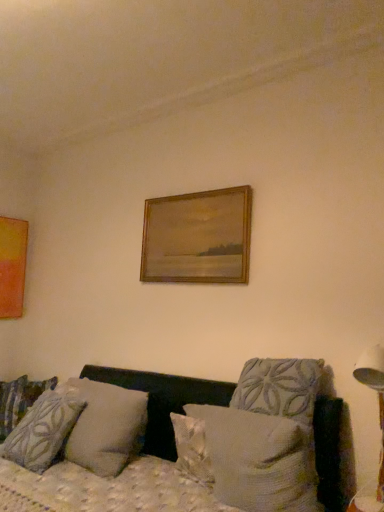
Question: Is matte orange picture frame at left, acting as the 2th picture frame starting from the front, positioned before textured fabric couch at lower center?

Choices:
 (A) yes
 (B) no

Answer: (B)

Question: Does matte orange picture frame at left, which appears as the 1th picture frame when viewed from the left, have a greater height compared to textured fabric couch at lower center?

Choices:
 (A) yes
 (B) no

Answer: (B)

Question: Is matte orange picture frame at left, positioned as the 1th picture frame in back-to-front order, positioned with its back to textured fabric couch at lower center?

Choices:
 (A) no
 (B) yes

Answer: (A)

Question: Can you confirm if matte orange picture frame at left, which appears as the 1th picture frame when viewed from the left, is thinner than textured fabric couch at lower center?

Choices:
 (A) no
 (B) yes

Answer: (B)

Question: From the image's perspective, is matte orange picture frame at left, acting as the 2th picture frame starting from the front, on textured fabric couch at lower center?

Choices:
 (A) no
 (B) yes

Answer: (B)

Question: From the image's perspective, relative to wooden frame at upper center, acting as the first picture frame starting from the right, is matte orange picture frame at left, positioned as the 1th picture frame in back-to-front order, above or below?

Choices:
 (A) below
 (B) above

Answer: (A)

Question: Looking at the image, does matte orange picture frame at left, which appears as the 1th picture frame when viewed from the left, seem bigger or smaller compared to wooden frame at upper center, the first picture frame when ordered from front to back?

Choices:
 (A) big
 (B) small

Answer: (A)

Question: Is point (13, 251) closer or farther from the camera than point (165, 262)?

Choices:
 (A) farther
 (B) closer

Answer: (A)

Question: From a real-world perspective, relative to wooden frame at upper center, acting as the first picture frame starting from the right, is matte orange picture frame at left, acting as the 2th picture frame starting from the front, vertically above or below?

Choices:
 (A) below
 (B) above

Answer: (A)

Question: In terms of width, does white plastic table lamp at right look wider or thinner when compared to patterned fabric pillow at left, positioned as the first pillow in left-to-right order?

Choices:
 (A) wide
 (B) thin

Answer: (A)

Question: Based on their positions, is white plastic table lamp at right located to the left or right of patterned fabric pillow at left, positioned as the first pillow in left-to-right order?

Choices:
 (A) left
 (B) right

Answer: (B)

Question: Considering the positions of white plastic table lamp at right and patterned fabric pillow at left, which ranks as the 4th pillow in right-to-left order, in the image, is white plastic table lamp at right taller or shorter than patterned fabric pillow at left, which ranks as the 4th pillow in right-to-left order,?

Choices:
 (A) tall
 (B) short

Answer: (A)

Question: From the image's perspective, is white plastic table lamp at right above or below patterned fabric pillow at left, which is the 1th pillow from back to front?

Choices:
 (A) below
 (B) above

Answer: (B)

Question: Is textured gray pillow at lower left, the third pillow from the right, taller or shorter than white plastic table lamp at right?

Choices:
 (A) short
 (B) tall

Answer: (A)

Question: From the image's perspective, is textured gray pillow at lower left, which is counted as the third pillow, starting from the back, located above or below white plastic table lamp at right?

Choices:
 (A) above
 (B) below

Answer: (B)